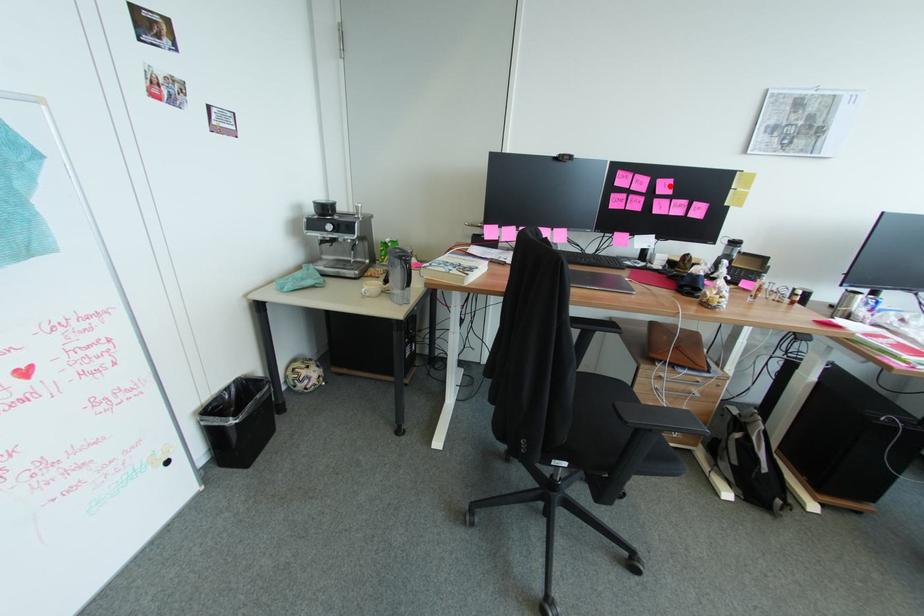
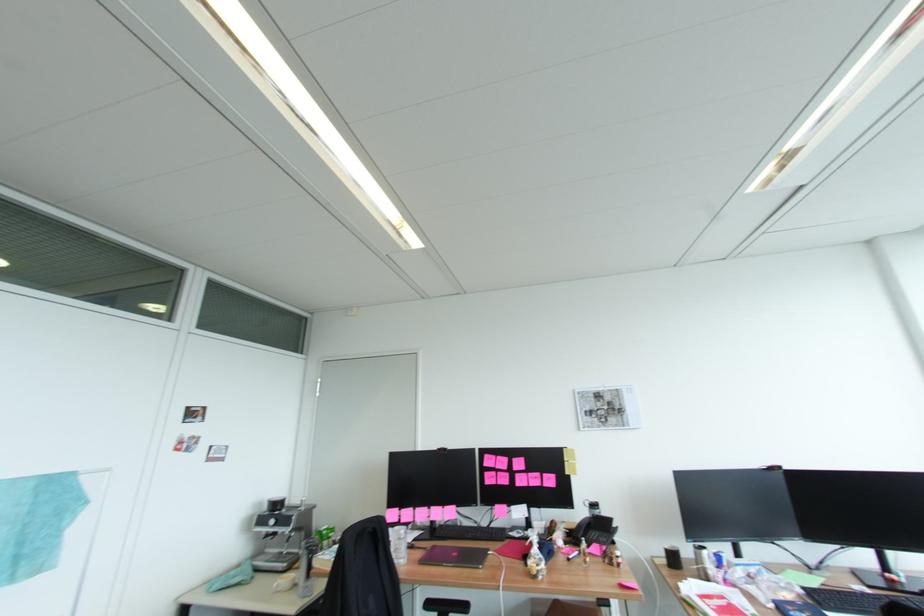
Locate, in the second image, the point that corresponds to the highlighted location in the first image.

(524, 463)